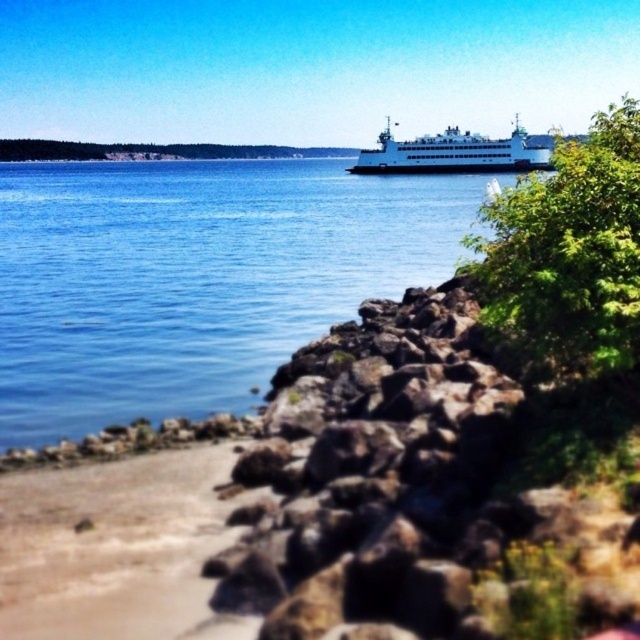
Question: Based on their relative distances, which object is farther from the green leafy tree at center right?

Choices:
 (A) white matte ferry at upper center
 (B) sandy beach at lower left

Answer: (A)

Question: Is blue water at center bigger than white matte ferry at upper center?

Choices:
 (A) yes
 (B) no

Answer: (A)

Question: Which point is farther to the camera?

Choices:
 (A) (442, 241)
 (B) (515, 150)

Answer: (B)

Question: Can you confirm if green leafy tree at center right is bigger than white matte ferry at upper center?

Choices:
 (A) no
 (B) yes

Answer: (A)

Question: Which object appears closest to the camera in this image?

Choices:
 (A) green leafy tree at center right
 (B) sandy beach at lower left

Answer: (B)

Question: Is blue water at center below white matte ferry at upper center?

Choices:
 (A) no
 (B) yes

Answer: (B)